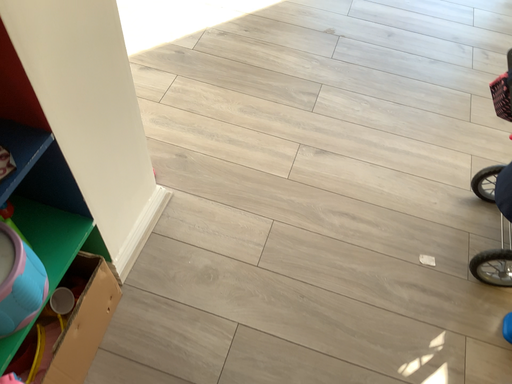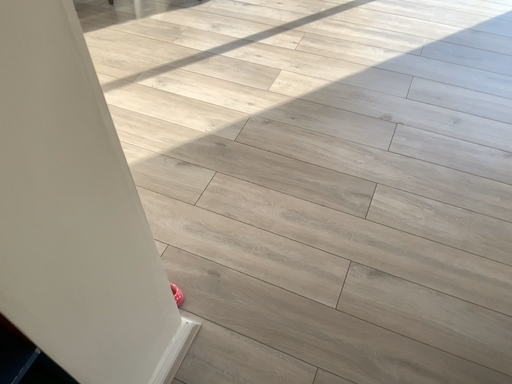
Question: How did the camera likely rotate when shooting the video?

Choices:
 (A) rotated right
 (B) rotated left

Answer: (B)